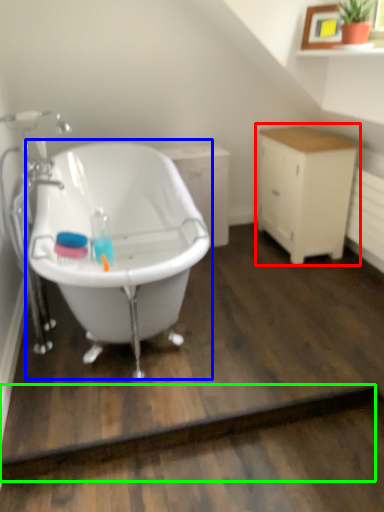
Question: Which object is positioned closest to cabinetry (highlighted by a red box)? Select from bathtub (highlighted by a blue box) and plank (highlighted by a green box).

Choices:
 (A) bathtub
 (B) plank

Answer: (A)